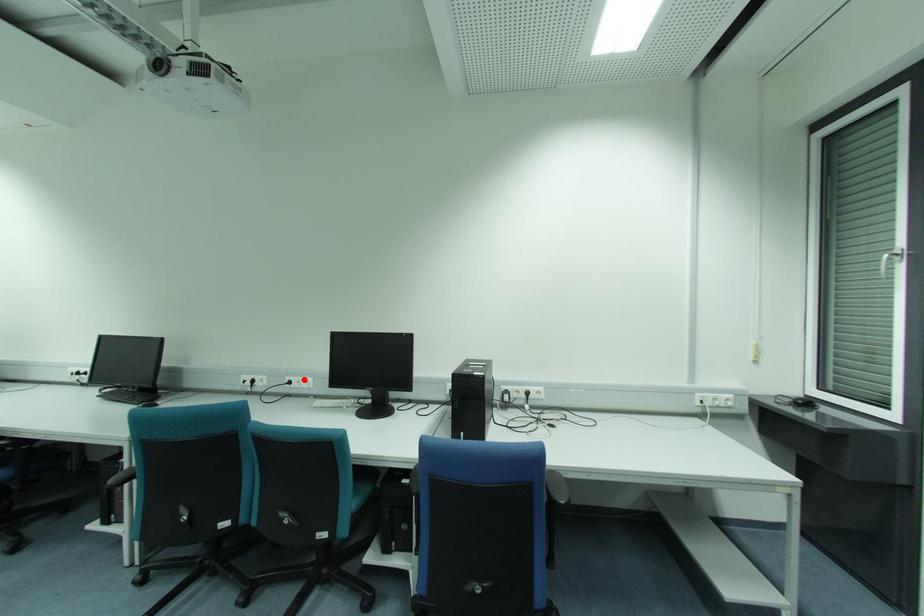
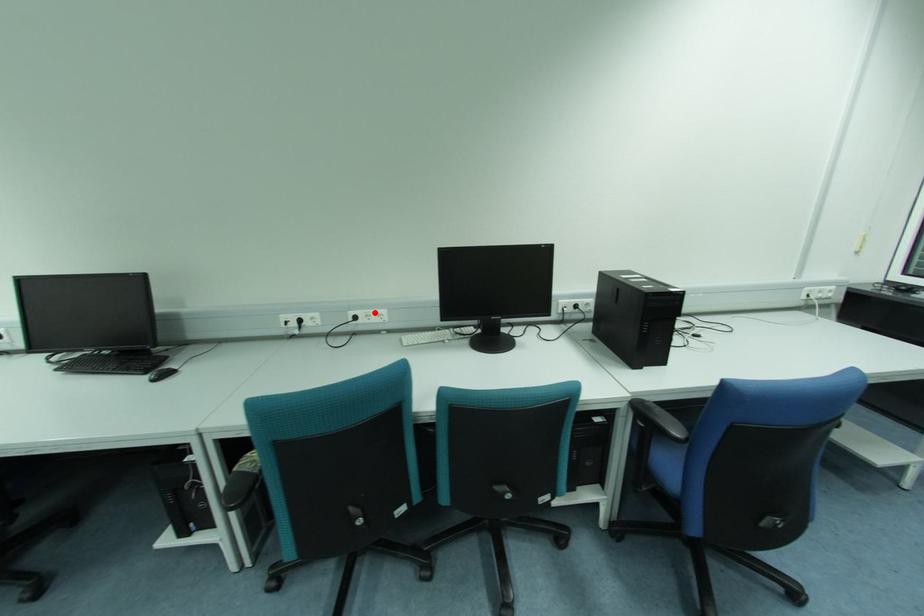
I am providing you with two images of the same scene from different viewpoints. A red point is marked on the first image and another point is marked on the second image. Are the points marked in image1 and image2 representing the same 3D position?

Yes